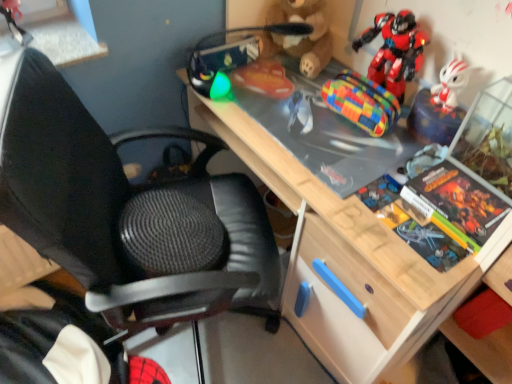
Where is `free location in front of multicolored woven pouch at center, arranged as the second toy when viewed from the right`? This screenshot has width=512, height=384. free location in front of multicolored woven pouch at center, arranged as the second toy when viewed from the right is located at coordinates pyautogui.click(x=351, y=156).